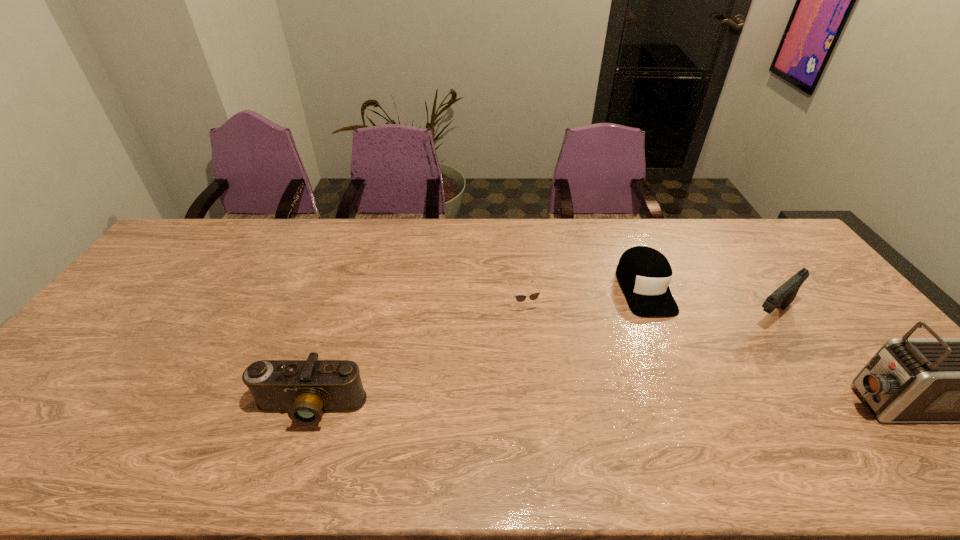
Where is `vacant space located 0.120m at the barrel of the pistol`? The height and width of the screenshot is (540, 960). vacant space located 0.120m at the barrel of the pistol is located at coordinates (732, 346).

You are a GUI agent. You are given a task and a screenshot of the screen. Output one action in this format:
    pyautogui.click(x=<x>, y=<y>)
    Task: Click on the vacant space situated at the barrel of the pistol
    
    Given the screenshot: What is the action you would take?
    pyautogui.click(x=733, y=344)

The width and height of the screenshot is (960, 540). Find the location of `vacant point located 0.160m in front of the lenses of the fourth object from right to left`. vacant point located 0.160m in front of the lenses of the fourth object from right to left is located at coordinates (549, 360).

This screenshot has height=540, width=960. What are the coordinates of `vacant region located in front of the lenses of the fourth object from right to left` in the screenshot? It's located at (561, 389).

This screenshot has width=960, height=540. In order to click on vacant region located 0.060m in front of the lenses of the fourth object from right to left in this screenshot , I will do `click(539, 333)`.

Locate an element on the screen. The image size is (960, 540). object that is at the near edge is located at coordinates (305, 389).

The image size is (960, 540). I want to click on object that is at the right edge, so click(x=782, y=297).

You are a GUI agent. You are given a task and a screenshot of the screen. Output one action in this format:
    pyautogui.click(x=<x>, y=<y>)
    Task: Click on the vacant space at the far edge
    The height and width of the screenshot is (540, 960).
    Given the screenshot: What is the action you would take?
    pyautogui.click(x=316, y=254)

Where is `vacant space at the near edge of the desktop`? The image size is (960, 540). vacant space at the near edge of the desktop is located at coordinates (170, 413).

In the image, there is a desktop. At what (x,y) coordinates should I click in order to perform the action: click on blank space at the left edge. Please return your answer as a coordinate pair (x, y). This screenshot has width=960, height=540. Looking at the image, I should click on (138, 292).